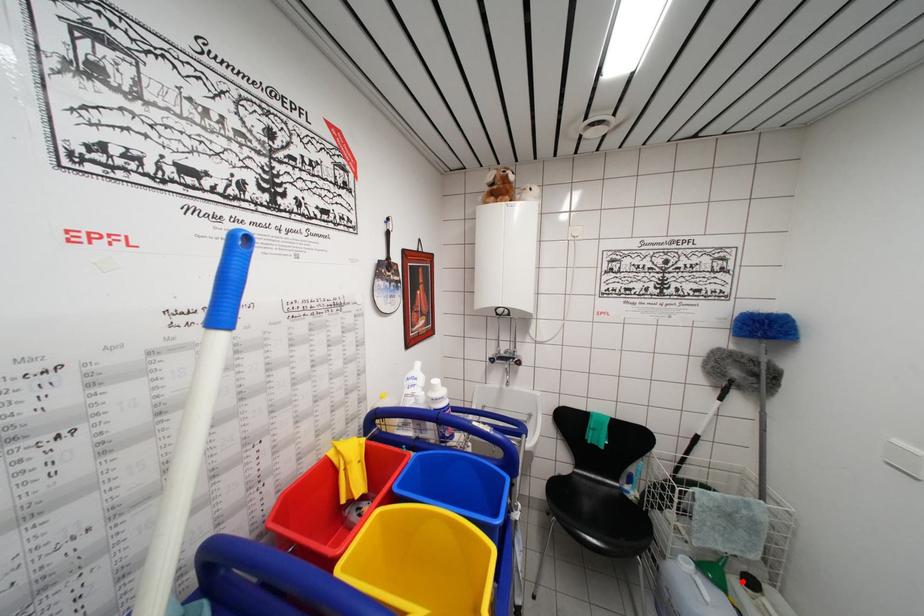
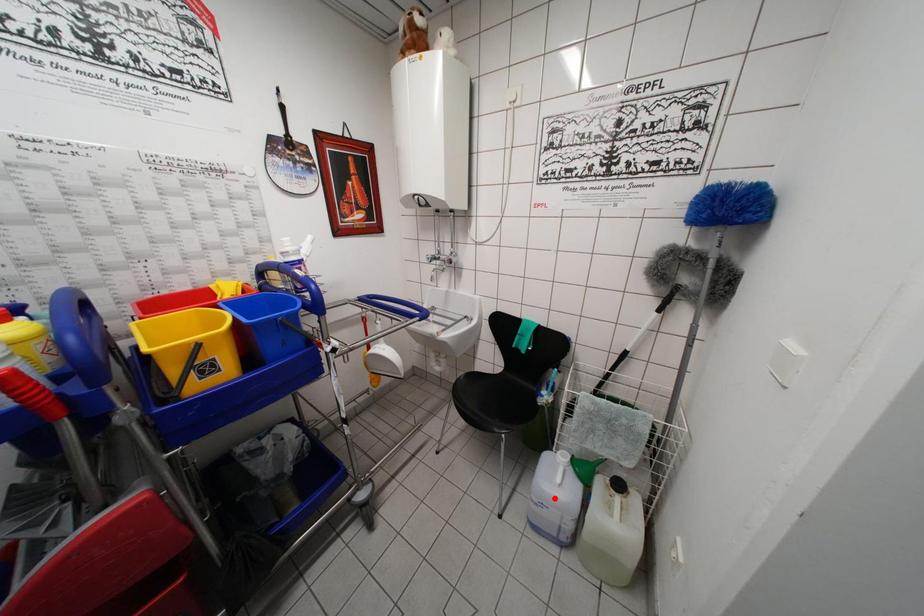
I am providing you with two images of the same scene from different viewpoints. A red point is marked on the first image and another point is marked on the second image. Are the points marked in image1 and image2 representing the same 3D position?

No